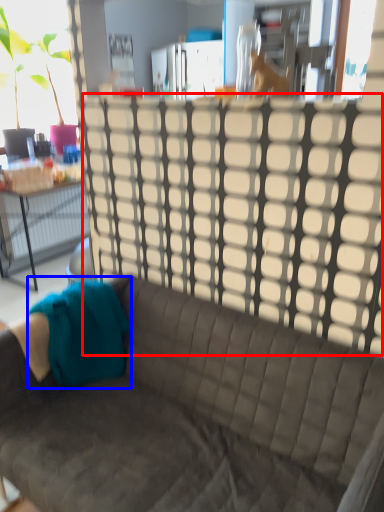
Question: Which object appears farthest to the camera in this image, glass door (highlighted by a red box) or fabric (highlighted by a blue box)?

Choices:
 (A) glass door
 (B) fabric

Answer: (B)